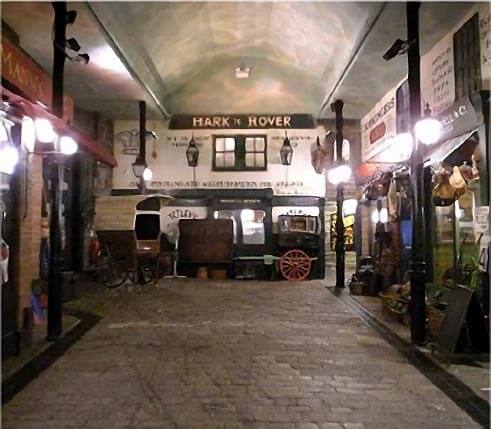
Locate an element on the screen. set of segmented windows center is located at coordinates (253, 145), (233, 149).